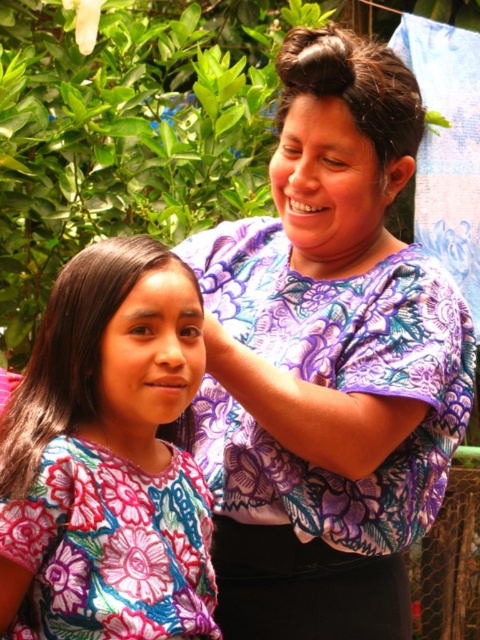
Looking at this image, who is positioned more to the right, floral fabric dress at left or dark brown silky hair at upper center?

Positioned to the right is dark brown silky hair at upper center.

Between point (140, 577) and point (372, 68), which one is positioned behind?

The point (372, 68) is more distant.

Where is `floral fabric dress at left`? The height and width of the screenshot is (640, 480). floral fabric dress at left is located at coordinates (108, 458).